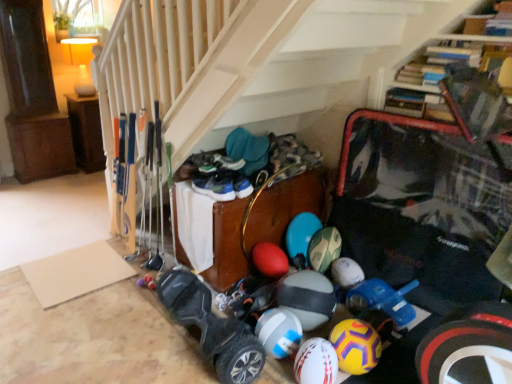
Question: From a real-world perspective, is white rubber beach ball at center above or below white matte bowling ball at center, the 2th bowling ball viewed from the right?

Choices:
 (A) above
 (B) below

Answer: (A)

Question: From the image's perspective, relative to white matte bowling ball at center, the 2th bowling ball viewed from the right, is white rubber beach ball at center above or below?

Choices:
 (A) above
 (B) below

Answer: (A)

Question: Which object is positioned closest to the wooden chest at center, the 2th furniture from the top?

Choices:
 (A) black rubber hoverboard at lower center
 (B) white rubber beach ball at center
 (C) white matte bowling ball at lower center, which is counted as the third bowling ball, starting from the left
 (D) white matte bowling ball at center, which is counted as the first bowling ball, starting from the left
 (E) white matte bowling ball at center, acting as the 2th bowling ball starting from the left

Answer: (B)

Question: Which object is the farthest from the white matte bowling ball at center, which ranks as the 3th bowling ball in right-to-left order?

Choices:
 (A) wooden chest at center, the second furniture positioned from the back
 (B) white matte bowling ball at lower center, placed as the 1th bowling ball when sorted from right to left
 (C) black rubber hoverboard at lower center
 (D) brown wood cabinet at left, which is the 2th furniture in right-to-left order
 (E) white rubber beach ball at center

Answer: (D)